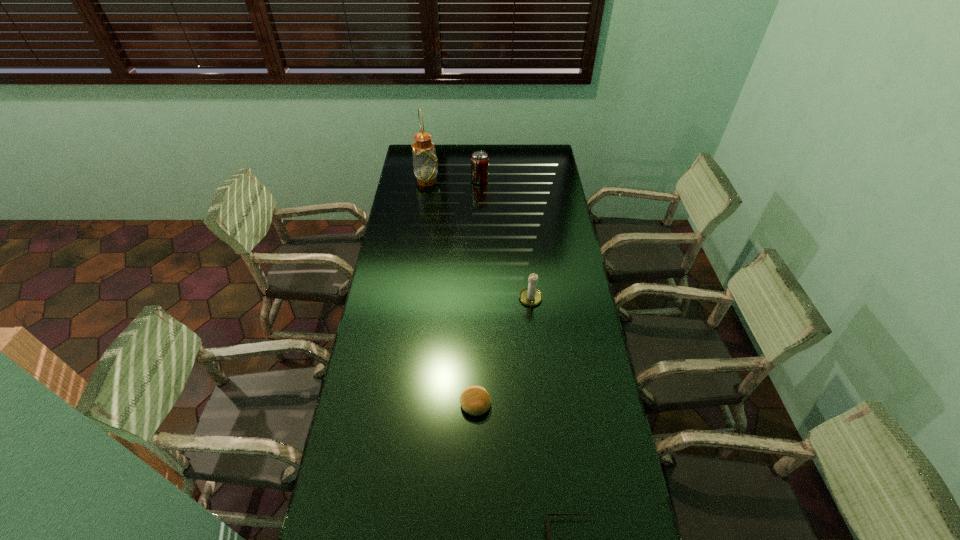
Find the location of a particular element. This screenshot has height=540, width=960. the tallest object is located at coordinates [x=425, y=162].

Where is `oil lamp`? oil lamp is located at coordinates (425, 162).

Identify the location of pop soda. (479, 161).

Image resolution: width=960 pixels, height=540 pixels. What are the coordinates of `candle holder` in the screenshot? It's located at (530, 296).

Where is `patty`? This screenshot has width=960, height=540. patty is located at coordinates (475, 400).

Locate an element on the screen. Image resolution: width=960 pixels, height=540 pixels. the shortest object is located at coordinates (475, 400).

The image size is (960, 540). Find the location of `free location located on the right of the leftmost object`. free location located on the right of the leftmost object is located at coordinates (472, 181).

Locate an element on the screen. free point located on the left of the pop soda is located at coordinates 432,180.

At what (x,y) coordinates should I click in order to perform the action: click on vacant area situated on the handle side of the candle holder. Please return your answer as a coordinate pair (x, y). The width and height of the screenshot is (960, 540). Looking at the image, I should click on (534, 325).

I want to click on vacant space located 0.150m on the left of the patty, so click(x=413, y=404).